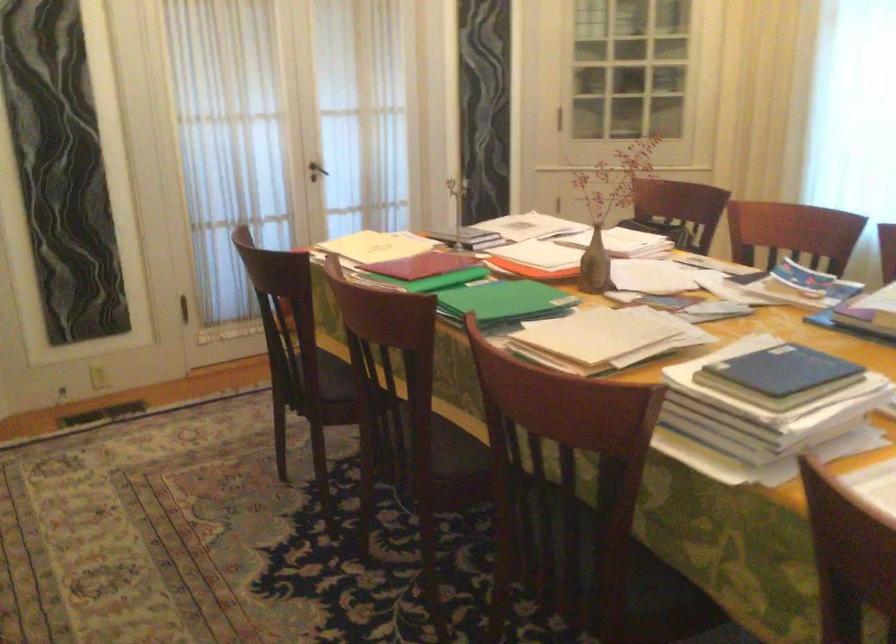
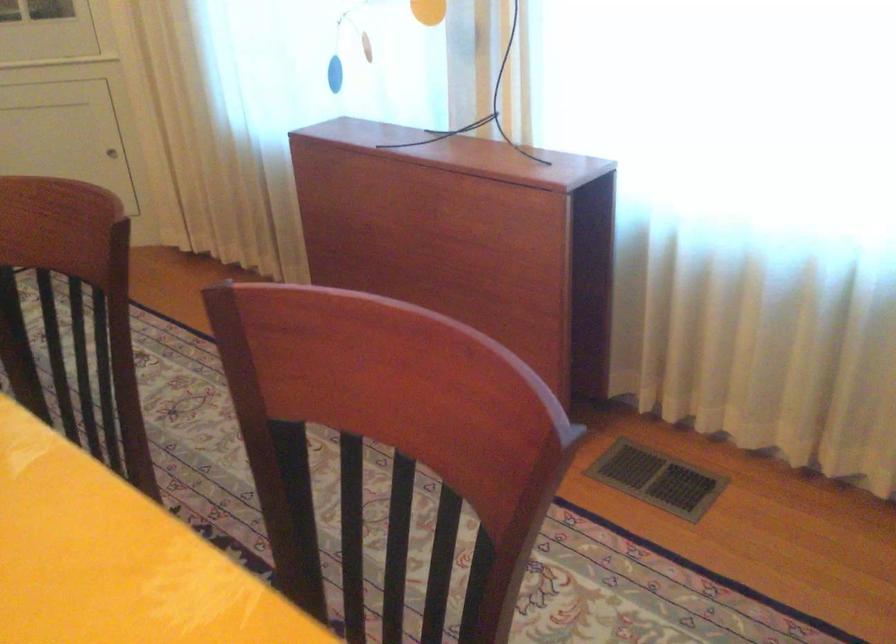
Which direction would the cameraman need to move to produce the second image?

The movement direction of the cameraman is right, forward.